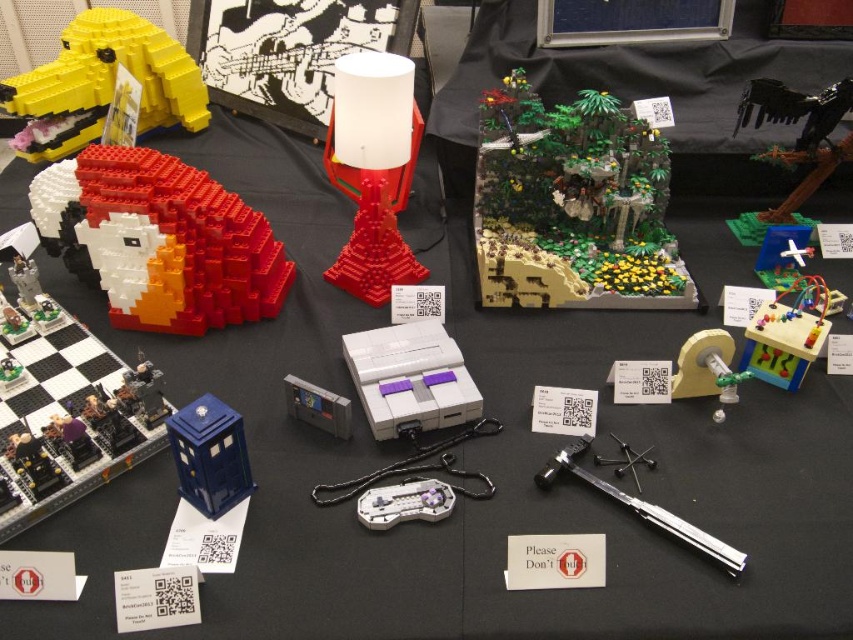
Which is below, white plastic game console at center or shiny black plastic dinosaur at upper right?

white plastic game console at center

Which is in front, point (428, 426) or point (817, 122)?

Point (428, 426) is more forward.

Identify the location of white plastic game console at center. (410, 378).

Who is positioned more to the left, bright red plastic bird at left or chrome metallic sword at center?

bright red plastic bird at left is more to the left.

Is bright red plastic bird at left wider than chrome metallic sword at center?

Indeed, bright red plastic bird at left has a greater width compared to chrome metallic sword at center.

Is point (242, 282) farther from camera compared to point (596, 476)?

Yes, it is.

Image resolution: width=853 pixels, height=640 pixels. I want to click on bright red plastic bird at left, so click(160, 241).

Is matte red lamp at center thinner than clear plastic game controller at center?

No, matte red lamp at center is not thinner than clear plastic game controller at center.

Is matte red lamp at center to the left of clear plastic game controller at center from the viewer's perspective?

Indeed, matte red lamp at center is positioned on the left side of clear plastic game controller at center.

Which is behind, point (358, 154) or point (381, 525)?

The point (358, 154) is behind.

Find the location of a particular element. The image size is (853, 640). matte red lamp at center is located at coordinates (373, 170).